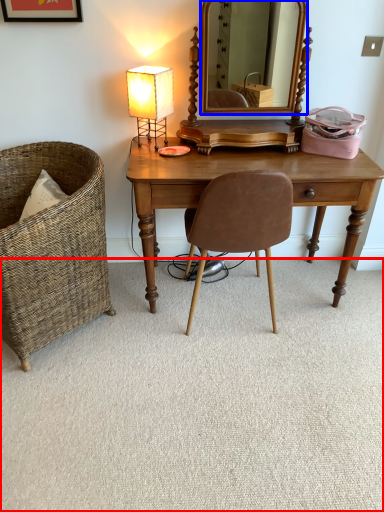
Question: Among these objects, which one is nearest to the camera, plain (highlighted by a red box) or mirror (highlighted by a blue box)?

Choices:
 (A) plain
 (B) mirror

Answer: (A)